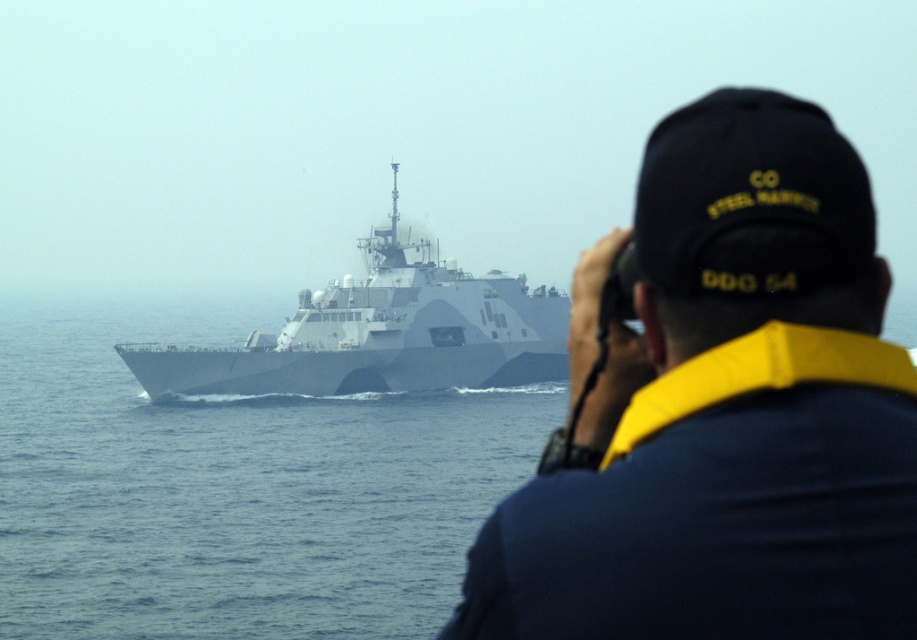
Does navy blue uniform at upper right appear on the right side of gray matte ship at center?

Correct, you'll find navy blue uniform at upper right to the right of gray matte ship at center.

Which is behind, point (901, 525) or point (389, 358)?

Positioned behind is point (389, 358).

Is point (837, 401) positioned in front of point (354, 362)?

Yes, it is.

The image size is (917, 640). I want to click on navy blue uniform at upper right, so click(x=724, y=410).

Between point (231, 429) and point (564, 307), which one is positioned behind?

Positioned behind is point (564, 307).

Does point (252, 500) come farther from viewer compared to point (381, 384)?

No.

Does point (318, 576) lie behind point (178, 372)?

No, it is not.

Where is `gray matte water at center`? gray matte water at center is located at coordinates (234, 490).

Between navy blue uniform at upper right and gray matte water at center, which one has more height?

navy blue uniform at upper right is taller.

Who is more distant from viewer, (665, 522) or (159, 552)?

Positioned behind is point (159, 552).

Which is in front, point (666, 577) or point (39, 419)?

Point (666, 577)

Where is `navy blue uniform at upper right`? navy blue uniform at upper right is located at coordinates (724, 410).